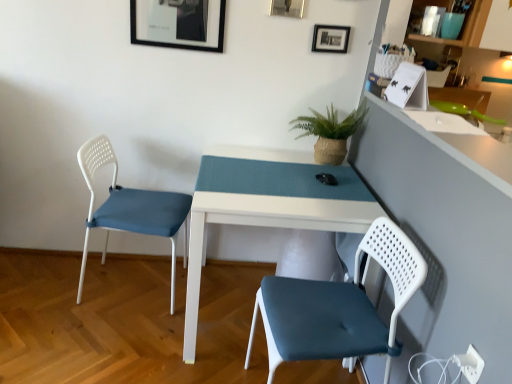
Question: Does black matte picture frame at upper center, which appears as the 3th picture frame when viewed from the left, come in front of metallic silver picture frame at upper center, placed as the 2th picture frame when sorted from left to right?

Choices:
 (A) no
 (B) yes

Answer: (A)

Question: Is black matte picture frame at upper center, which appears as the 3th picture frame when viewed from the left, positioned far away from metallic silver picture frame at upper center, acting as the second picture frame starting from the right?

Choices:
 (A) yes
 (B) no

Answer: (B)

Question: Is black matte picture frame at upper center, which appears as the 3th picture frame when viewed from the left, oriented away from metallic silver picture frame at upper center, acting as the second picture frame starting from the right?

Choices:
 (A) no
 (B) yes

Answer: (A)

Question: Is black matte picture frame at upper center, which appears as the 3th picture frame when viewed from the left, with metallic silver picture frame at upper center, placed as the 2th picture frame when sorted from left to right?

Choices:
 (A) no
 (B) yes

Answer: (A)

Question: From a real-world perspective, is black matte picture frame at upper center, which is the 1th picture frame from right to left, positioned over metallic silver picture frame at upper center, placed as the 2th picture frame when sorted from left to right, based on gravity?

Choices:
 (A) yes
 (B) no

Answer: (B)

Question: From the image's perspective, relative to matte white chair at lower right, which is the 1th chair in front-to-back order, is matte glass shelf at upper right above or below?

Choices:
 (A) above
 (B) below

Answer: (A)

Question: Considering the positions of matte glass shelf at upper right and matte white chair at lower right, which appears as the second chair when viewed from the back, in the image, is matte glass shelf at upper right taller or shorter than matte white chair at lower right, which appears as the second chair when viewed from the back,?

Choices:
 (A) tall
 (B) short

Answer: (B)

Question: From a real-world perspective, is matte glass shelf at upper right above or below matte white chair at lower right, which is the 1th chair in front-to-back order?

Choices:
 (A) above
 (B) below

Answer: (A)

Question: Is matte glass shelf at upper right to the left or to the right of matte white chair at lower right, which appears as the second chair when viewed from the back, in the image?

Choices:
 (A) left
 (B) right

Answer: (B)

Question: Based on their positions, is matte glass shelf at upper right located to the left or right of matte black picture frame at upper center, the first picture frame from the left?

Choices:
 (A) right
 (B) left

Answer: (A)

Question: Is point (468, 41) closer or farther from the camera than point (176, 18)?

Choices:
 (A) closer
 (B) farther

Answer: (A)

Question: From a real-world perspective, is matte glass shelf at upper right physically located above or below matte black picture frame at upper center, marked as the 3th picture frame in a right-to-left arrangement?

Choices:
 (A) below
 (B) above

Answer: (B)

Question: Is matte glass shelf at upper right wider or thinner than matte black picture frame at upper center, the first picture frame from the left?

Choices:
 (A) thin
 (B) wide

Answer: (B)

Question: From a real-world perspective, is matte black picture frame at upper center, marked as the 3th picture frame in a right-to-left arrangement, above or below white matte table at center?

Choices:
 (A) above
 (B) below

Answer: (A)

Question: Do you think matte black picture frame at upper center, marked as the 3th picture frame in a right-to-left arrangement, is within white matte table at center, or outside of it?

Choices:
 (A) outside
 (B) inside

Answer: (A)